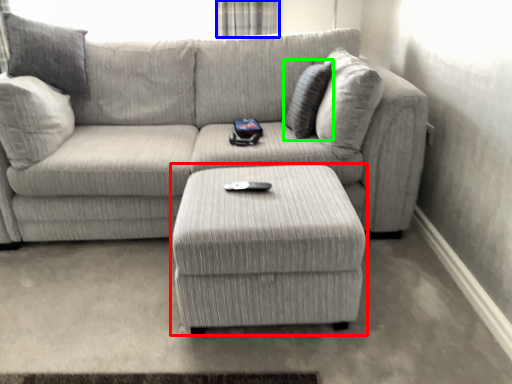
Question: Considering the real-world distances, which object is closest to table (highlighted by a red box)? curtain (highlighted by a blue box) or pillow (highlighted by a green box).

Choices:
 (A) curtain
 (B) pillow

Answer: (B)